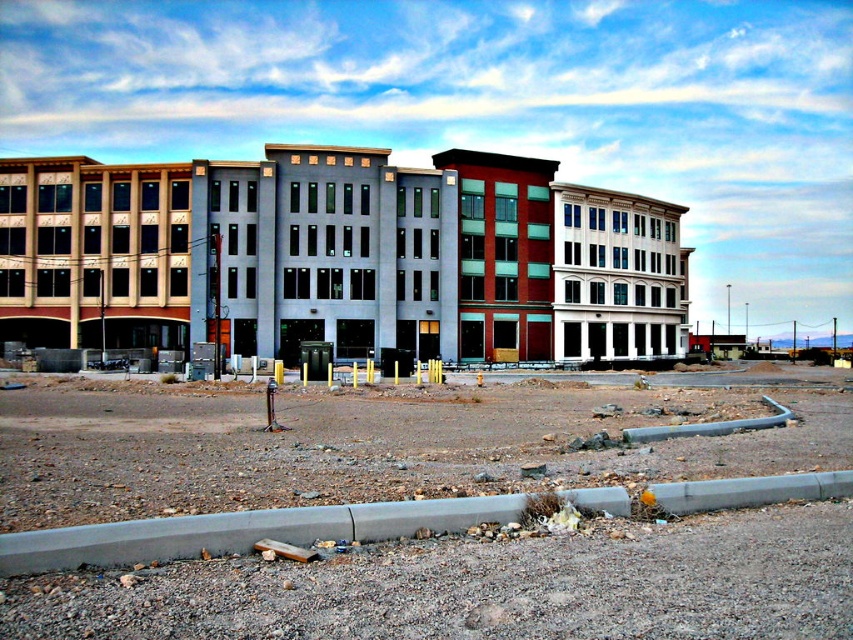
Question: Is brown gravel dirt field at lower center positioned behind matte gray building at center?

Choices:
 (A) no
 (B) yes

Answer: (A)

Question: Which point is closer to the camera?

Choices:
 (A) matte gray building at center
 (B) brown gravel dirt field at lower center

Answer: (B)

Question: Does brown gravel dirt field at lower center appear under matte gray building at center?

Choices:
 (A) no
 (B) yes

Answer: (B)

Question: Is brown gravel dirt field at lower center to the left of matte gray building at center from the viewer's perspective?

Choices:
 (A) no
 (B) yes

Answer: (B)

Question: Which of the following is the farthest from the observer?

Choices:
 (A) brown gravel dirt field at lower center
 (B) matte gray building at center

Answer: (B)